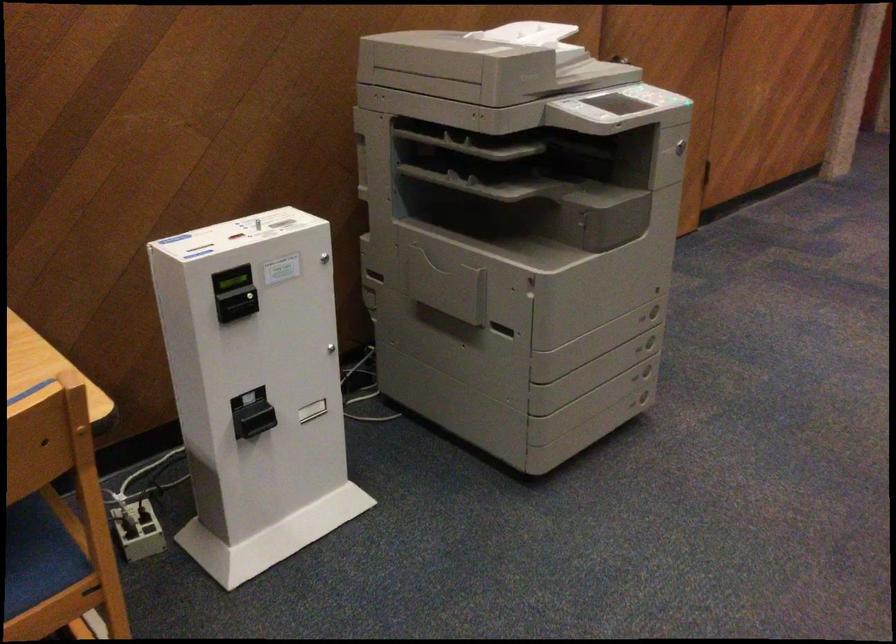
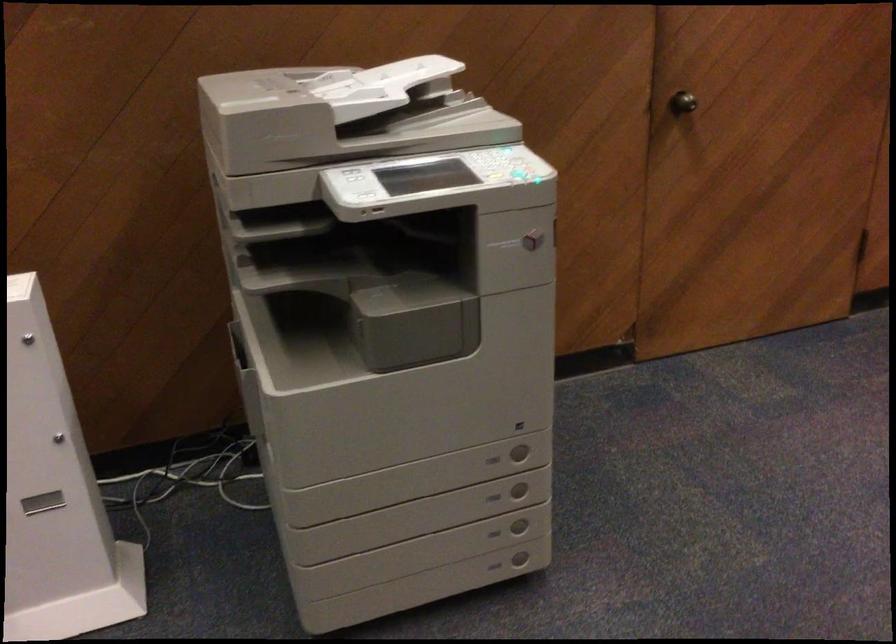
Locate, in the second image, the point that corresponds to point 647,398 in the first image.

(520, 559)